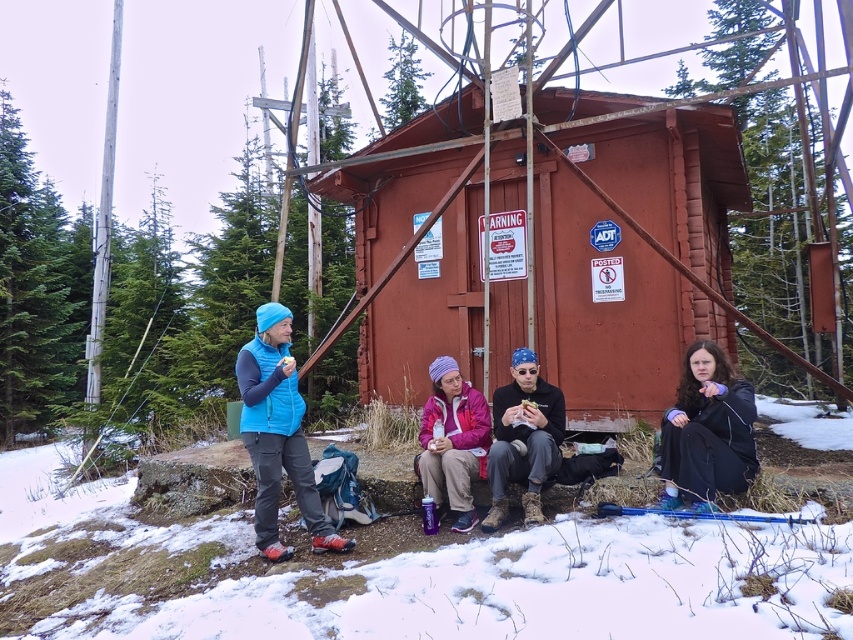
Consider the image. Is blue fleece vest at center bigger than purple fleece jacket at center?

Yes.

Is blue fleece vest at center thinner than purple fleece jacket at center?

No, blue fleece vest at center is not thinner than purple fleece jacket at center.

Is point (306, 448) closer to viewer compared to point (451, 394)?

That is True.

The width and height of the screenshot is (853, 640). I want to click on blue fleece vest at center, so click(x=277, y=435).

Does point (781, 557) lie behind point (283, 554)?

No, it is in front of (283, 554).

Is white powdery snow at lower left wider than blue fleece vest at center?

In fact, white powdery snow at lower left might be narrower than blue fleece vest at center.

Identify the location of white powdery snow at lower left. (399, 573).

Is white powdery snow at lower left taller than purple fleece jacket at lower right?

No.

Looking at this image, does white powdery snow at lower left lie behind purple fleece jacket at lower right?

No, it is in front of purple fleece jacket at lower right.

Which is in front, point (747, 552) or point (738, 401)?

Point (747, 552) is in front.

Find the location of a particular element. white powdery snow at lower left is located at coordinates (399, 573).